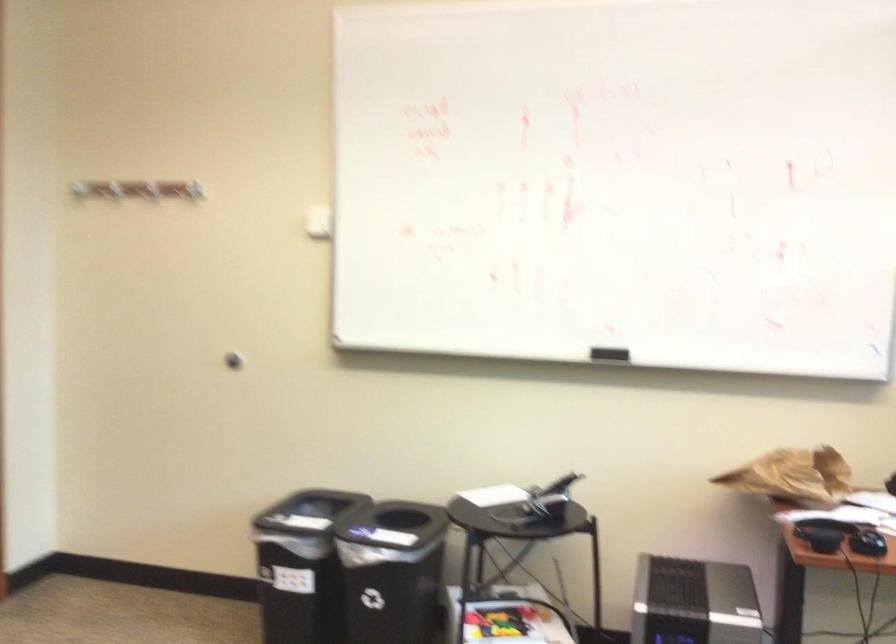
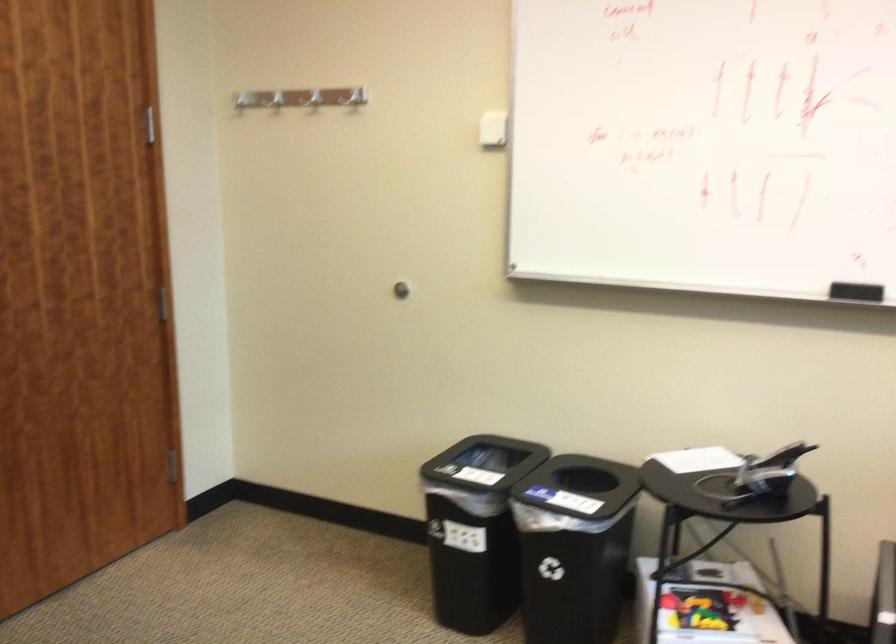
In the second image, find the point that corresponds to the point at 76,180 in the first image.

(240, 100)